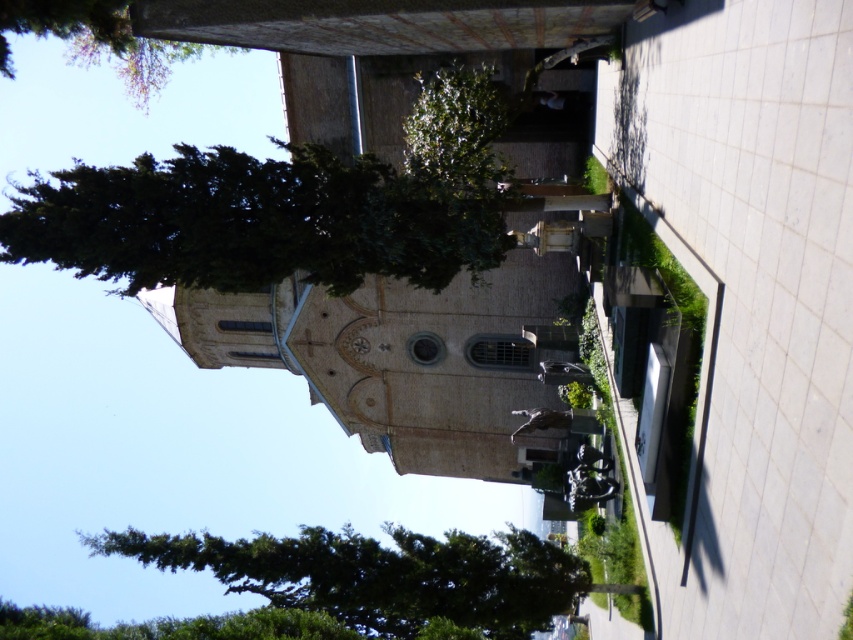
Question: Does dark green leafy tree at upper left lie behind green leafy tree at upper left?

Choices:
 (A) no
 (B) yes

Answer: (B)

Question: Which point is closer to the camera?

Choices:
 (A) (410, 166)
 (B) (10, 72)
 (C) (38, 179)
 (D) (323, 540)

Answer: (C)

Question: Is dark green leafy tree at upper left positioned at the back of green textured tree at left?

Choices:
 (A) no
 (B) yes

Answer: (A)

Question: Is green textured tree at left wider than green leafy tree at center?

Choices:
 (A) no
 (B) yes

Answer: (B)

Question: Which object appears closest to the camera in this image?

Choices:
 (A) green leafy tree at center
 (B) dark green leafy tree at upper left
 (C) green textured tree at left
 (D) green leafy tree at upper left

Answer: (D)

Question: Among these points, which one is farthest from the camera?

Choices:
 (A) (381, 170)
 (B) (444, 157)
 (C) (35, 22)
 (D) (378, 614)

Answer: (D)